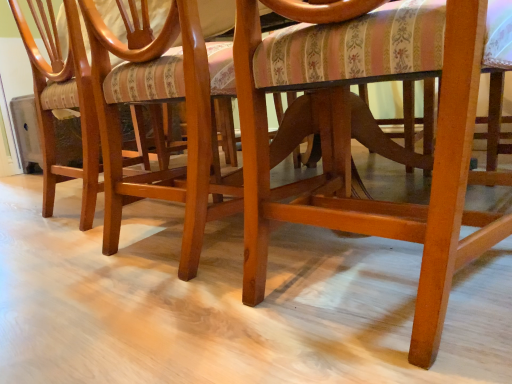
Question: Is point (90, 16) closer or farther from the camera than point (48, 148)?

Choices:
 (A) closer
 (B) farther

Answer: (A)

Question: Relative to glossy wood chair at lower left, the 2th chair viewed from the right, is matte wood chair at center, acting as the 1th chair starting from the right, in front or behind?

Choices:
 (A) front
 (B) behind

Answer: (A)

Question: From the image's perspective, is matte wood chair at center, acting as the 1th chair starting from the right, above or below glossy wood chair at lower left, placed as the first chair when sorted from left to right?

Choices:
 (A) below
 (B) above

Answer: (A)

Question: From a real-world perspective, relative to matte wood chair at center, acting as the 1th chair starting from the right, is glossy wood chair at lower left, placed as the first chair when sorted from left to right, vertically above or below?

Choices:
 (A) above
 (B) below

Answer: (A)

Question: In terms of height, does glossy wood chair at lower left, the 2th chair viewed from the right, look taller or shorter compared to matte wood chair at center, acting as the 1th chair starting from the right?

Choices:
 (A) tall
 (B) short

Answer: (A)

Question: Would you say glossy wood chair at lower left, the 2th chair viewed from the right, is to the left or to the right of matte wood chair at center, acting as the 1th chair starting from the right, in the picture?

Choices:
 (A) right
 (B) left

Answer: (B)

Question: Looking at the image, does glossy wood chair at lower left, placed as the first chair when sorted from left to right, seem bigger or smaller compared to matte wood chair at center, acting as the 1th chair starting from the right?

Choices:
 (A) small
 (B) big

Answer: (B)